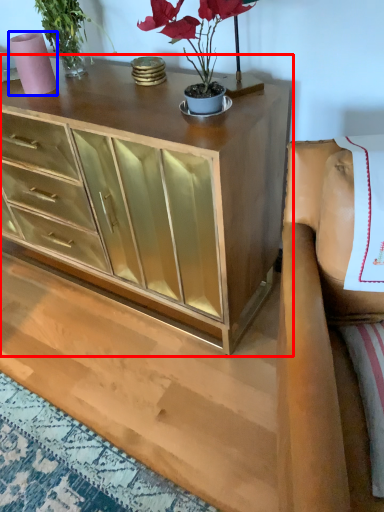
Question: Which object is closer to the camera taking this photo, chest of drawers (highlighted by a red box) or vase (highlighted by a blue box)?

Choices:
 (A) chest of drawers
 (B) vase

Answer: (A)